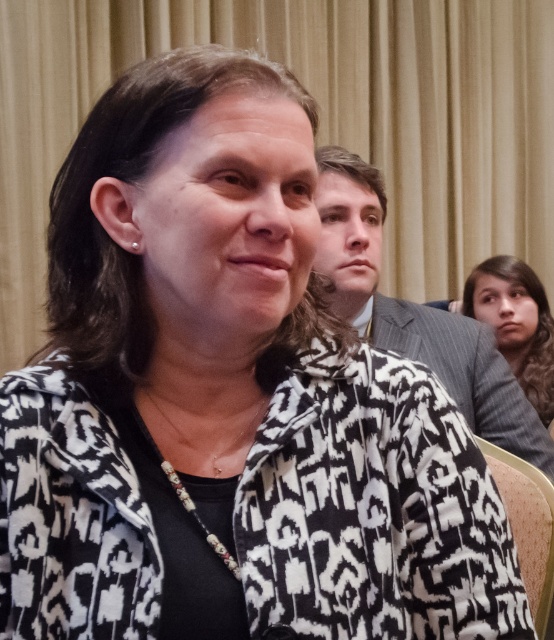
Question: Based on their relative distances, which object is farther from the beige fabric chair at lower right?

Choices:
 (A) gray wool sweater at lower right
 (B) black and white patterned jacket at center
 (C) gray suit jacket at upper center

Answer: (A)

Question: Is black and white patterned jacket at center positioned at the back of gray suit jacket at upper center?

Choices:
 (A) yes
 (B) no

Answer: (B)

Question: Among these points, which one is farthest from the camera?

Choices:
 (A) (64, 419)
 (B) (517, 333)

Answer: (B)

Question: Does gray suit jacket at upper center lie in front of beige fabric chair at lower right?

Choices:
 (A) yes
 (B) no

Answer: (B)

Question: Which object appears farthest from the camera in this image?

Choices:
 (A) beige fabric chair at lower right
 (B) gray wool sweater at lower right
 (C) black and white patterned jacket at center
 (D) gray suit jacket at upper center

Answer: (B)

Question: Is black and white patterned jacket at center thinner than gray suit jacket at upper center?

Choices:
 (A) no
 (B) yes

Answer: (B)